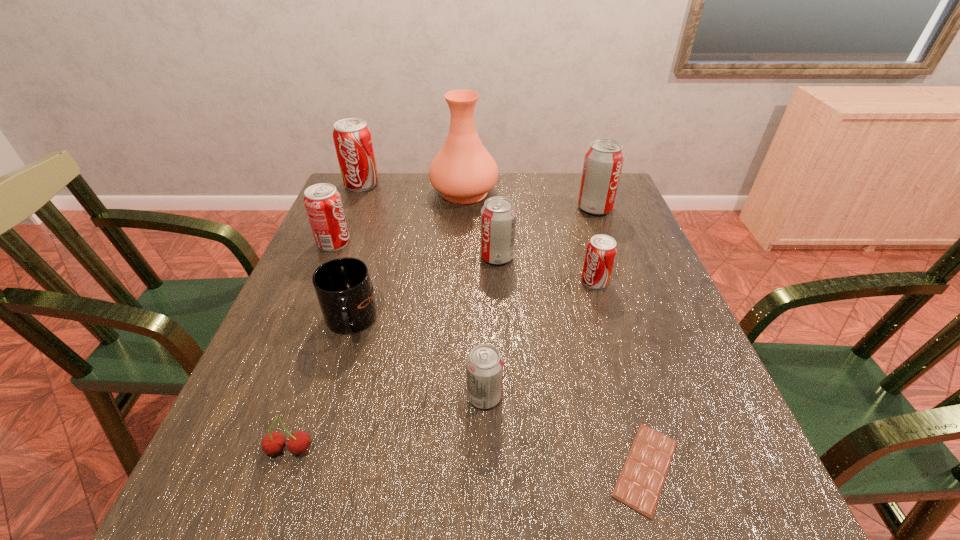
Where is `the smallest red soda can`? The image size is (960, 540). the smallest red soda can is located at coordinates click(601, 251).

At what (x,y) coordinates should I click in order to perform the action: click on the nearest gray soda can. Please return your answer as a coordinate pair (x, y). This screenshot has height=540, width=960. Looking at the image, I should click on click(484, 365).

Find the location of a particular element. Image resolution: width=960 pixels, height=540 pixels. the nearest soda can is located at coordinates (484, 365).

Identify the location of the second shortest object. This screenshot has height=540, width=960. (273, 443).

This screenshot has width=960, height=540. I want to click on the shortest object, so click(639, 486).

What are the coordinates of `free location located 0.340m on the front of the vase` in the screenshot? It's located at (459, 289).

The image size is (960, 540). I want to click on free point located on the front of the biggest red soda can, so click(333, 253).

Where is `vacant region located 0.100m on the back of the biggest gray soda can`? Image resolution: width=960 pixels, height=540 pixels. vacant region located 0.100m on the back of the biggest gray soda can is located at coordinates (586, 182).

The image size is (960, 540). I want to click on vacant space located 0.170m on the left of the second biggest gray soda can, so pyautogui.click(x=413, y=257).

I want to click on vacant space located 0.190m on the back of the second biggest red soda can, so click(353, 197).